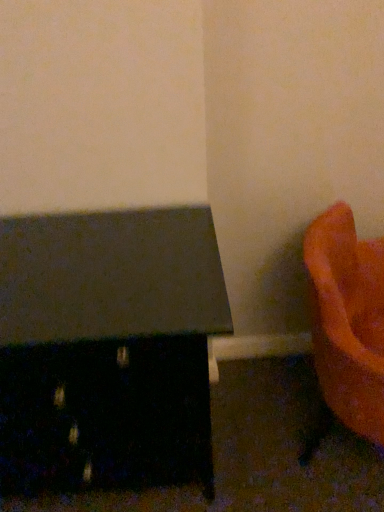
Question: In terms of height, does orange matte vase at lower right, the second furniture from the left, look taller or shorter compared to matte black table at left, which is the 2th furniture in right-to-left order?

Choices:
 (A) short
 (B) tall

Answer: (A)

Question: Considering the relative positions of orange matte vase at lower right, positioned as the first furniture in right-to-left order, and matte black table at left, the first furniture in the left-to-right sequence, in the image provided, is orange matte vase at lower right, positioned as the first furniture in right-to-left order, to the left or to the right of matte black table at left, the first furniture in the left-to-right sequence,?

Choices:
 (A) right
 (B) left

Answer: (A)

Question: In the image, is orange matte vase at lower right, positioned as the first furniture in right-to-left order, positioned in front of or behind matte black table at left, which is the 2th furniture in right-to-left order?

Choices:
 (A) behind
 (B) front

Answer: (B)

Question: From their relative heights in the image, would you say matte black table at left, the first furniture in the left-to-right sequence, is taller or shorter than orange matte vase at lower right, the second furniture from the left?

Choices:
 (A) short
 (B) tall

Answer: (B)

Question: Considering the positions of matte black table at left, the first furniture in the left-to-right sequence, and orange matte vase at lower right, positioned as the first furniture in right-to-left order, in the image, is matte black table at left, the first furniture in the left-to-right sequence, wider or thinner than orange matte vase at lower right, positioned as the first furniture in right-to-left order,?

Choices:
 (A) thin
 (B) wide

Answer: (B)

Question: From a real-world perspective, is matte black table at left, which is the 2th furniture in right-to-left order, above or below orange matte vase at lower right, positioned as the first furniture in right-to-left order?

Choices:
 (A) above
 (B) below

Answer: (A)

Question: Is point (188, 274) closer or farther from the camera than point (334, 256)?

Choices:
 (A) closer
 (B) farther

Answer: (A)